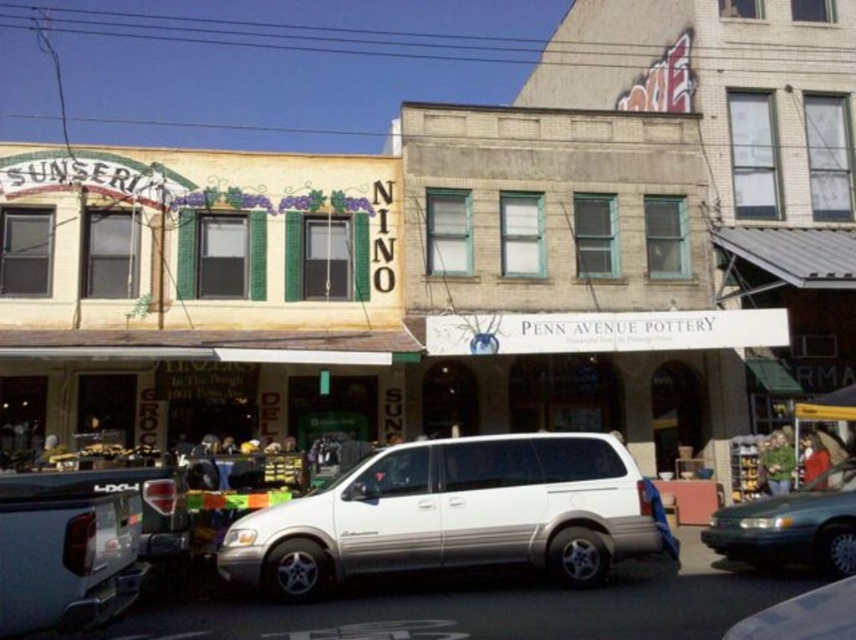
You are a GUI agent. You are given a task and a screenshot of the screen. Output one action in this format:
    pyautogui.click(x=<x>, y=<y>)
    Task: Click on the green metallic sedan at lower right
    The width and height of the screenshot is (856, 640).
    Given the screenshot: What is the action you would take?
    pyautogui.click(x=794, y=525)

Is point (746, 557) farther from viewer compared to point (752, 620)?

Yes.

I want to click on green metallic sedan at lower right, so click(794, 525).

Is white matte suv at center to the right of green metallic sedan at lower right from the viewer's perspective?

Incorrect, white matte suv at center is not on the right side of green metallic sedan at lower right.

Can you confirm if white matte suv at center is positioned to the left of green metallic sedan at lower right?

Indeed, white matte suv at center is positioned on the left side of green metallic sedan at lower right.

Is point (626, 474) positioned behind point (724, 545)?

No, (626, 474) is closer to viewer.

Where is `white matte suv at center`? The height and width of the screenshot is (640, 856). white matte suv at center is located at coordinates (456, 515).

Does silver metallic suv at lower left appear on the right side of green metallic sedan at lower right?

Incorrect, silver metallic suv at lower left is not on the right side of green metallic sedan at lower right.

Between silver metallic suv at lower left and green metallic sedan at lower right, which one appears on the right side from the viewer's perspective?

green metallic sedan at lower right is more to the right.

Is point (60, 525) less distant than point (716, 515)?

Yes, point (60, 525) is closer to viewer.

Locate an element on the screen. This screenshot has height=640, width=856. silver metallic suv at lower left is located at coordinates (66, 556).